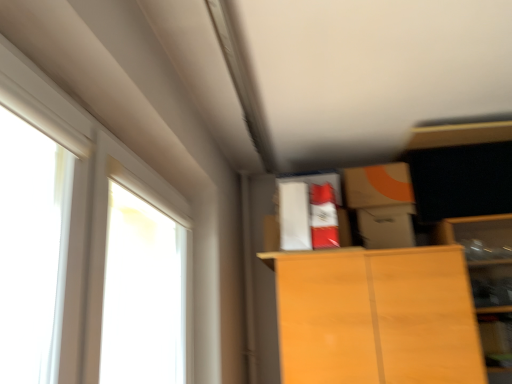
Based on the photo, measure the distance between point (10,67) and camera.

A distance of 79.00 centimeters exists between point (10,67) and camera.

Locate an element on the screen. This screenshot has width=512, height=384. white glossy window at upper left, the 1th window from the back is located at coordinates (87, 203).

What do you see at coordinates (87, 203) in the screenshot? I see `white glossy window at upper left, the second window viewed from the front` at bounding box center [87, 203].

Measure the distance between point (8,329) and camera.

Point (8,329) and camera are 6.59 feet apart.

Identify the location of white glossy window at left, the first window viewed from the front. (32, 249).

What do you see at coordinates (32, 249) in the screenshot? This screenshot has height=384, width=512. I see `white glossy window at left, the first window viewed from the front` at bounding box center [32, 249].

Identify the location of white glossy window at upper left, the 1th window from the back. (87, 203).

Looking at this image, based on their positions, is white glossy window at upper left, the 1th window from the back, located to the left or right of white glossy window at left, arranged as the second window when viewed from the back?

From the image, it's evident that white glossy window at upper left, the 1th window from the back, is to the right of white glossy window at left, arranged as the second window when viewed from the back.

Considering their positions, is white glossy window at upper left, the 1th window from the back, located in front of or behind white glossy window at left, arranged as the second window when viewed from the back?

white glossy window at upper left, the 1th window from the back, is behind white glossy window at left, arranged as the second window when viewed from the back.

Based on the photo, which is more distant, (92, 340) or (38, 246)?

Point (38, 246)

From the image's perspective, relative to white glossy window at left, the first window viewed from the front, is white glossy window at upper left, the second window viewed from the front, above or below?

white glossy window at upper left, the second window viewed from the front, is situated lower than white glossy window at left, the first window viewed from the front, in the image.

From a real-world perspective, which is physically below, white glossy window at upper left, the second window viewed from the front, or white glossy window at left, the first window viewed from the front?

From a 3D spatial view, white glossy window at upper left, the second window viewed from the front, is below.

Considering the sizes of objects white glossy window at upper left, the second window viewed from the front, and white glossy window at left, the first window viewed from the front, in the image provided, who is thinner, white glossy window at upper left, the second window viewed from the front, or white glossy window at left, the first window viewed from the front,?

white glossy window at left, the first window viewed from the front.

Can you confirm if white glossy window at upper left, the second window viewed from the front, is taller than white glossy window at left, the first window viewed from the front?

Indeed, white glossy window at upper left, the second window viewed from the front, has a greater height compared to white glossy window at left, the first window viewed from the front.

Considering the sizes of white glossy window at upper left, the 1th window from the back, and white glossy window at left, arranged as the second window when viewed from the back, in the image, is white glossy window at upper left, the 1th window from the back, bigger or smaller than white glossy window at left, arranged as the second window when viewed from the back,?

Considering their sizes, white glossy window at upper left, the 1th window from the back, takes up more space than white glossy window at left, arranged as the second window when viewed from the back.

Would you say white glossy window at upper left, the 1th window from the back, is outside white glossy window at left, the first window viewed from the front?

white glossy window at upper left, the 1th window from the back, is positioned outside white glossy window at left, the first window viewed from the front.

Can you see white glossy window at upper left, the second window viewed from the front, touching white glossy window at left, the first window viewed from the front?

There is a gap between white glossy window at upper left, the second window viewed from the front, and white glossy window at left, the first window viewed from the front.

Does white glossy window at upper left, the 1th window from the back, turn towards white glossy window at left, the first window viewed from the front?

No, white glossy window at upper left, the 1th window from the back, is not aimed at white glossy window at left, the first window viewed from the front.

How many degrees apart are the facing directions of white glossy window at upper left, the 1th window from the back, and white glossy window at left, the first window viewed from the front?

The angular difference between white glossy window at upper left, the 1th window from the back, and white glossy window at left, the first window viewed from the front, is 0.212 degrees.

The image size is (512, 384). I want to click on window above the white glossy window at upper left, the second window viewed from the front (from the image's perspective), so click(32, 249).

Is white glossy window at left, the first window viewed from the front, to the left of white glossy window at upper left, the second window viewed from the front, from the viewer's perspective?

Yes.

Which object is further away from the camera taking this photo, white glossy window at left, arranged as the second window when viewed from the back, or white glossy window at upper left, the second window viewed from the front?

white glossy window at upper left, the second window viewed from the front, is behind.

Is point (57, 362) behind point (85, 179)?

That is False.

From the image's perspective, is white glossy window at left, the first window viewed from the front, located above or below white glossy window at upper left, the 1th window from the back?

Based on their image positions, white glossy window at left, the first window viewed from the front, is located above white glossy window at upper left, the 1th window from the back.

From a real-world perspective, is white glossy window at left, the first window viewed from the front, positioned above or below white glossy window at upper left, the 1th window from the back?

In terms of real-world spatial position, white glossy window at left, the first window viewed from the front, is above white glossy window at upper left, the 1th window from the back.

Does white glossy window at left, the first window viewed from the front, have a greater width compared to white glossy window at upper left, the 1th window from the back?

No.

Considering the sizes of white glossy window at left, arranged as the second window when viewed from the back, and white glossy window at upper left, the 1th window from the back, in the image, is white glossy window at left, arranged as the second window when viewed from the back, taller or shorter than white glossy window at upper left, the 1th window from the back,?

Clearly, white glossy window at left, arranged as the second window when viewed from the back, is shorter compared to white glossy window at upper left, the 1th window from the back.

Can you confirm if white glossy window at left, the first window viewed from the front, is smaller than white glossy window at upper left, the 1th window from the back?

Yes.

Is white glossy window at left, the first window viewed from the front, surrounding white glossy window at upper left, the second window viewed from the front?

No, white glossy window at upper left, the second window viewed from the front, is not a part of white glossy window at left, the first window viewed from the front.

Are white glossy window at left, the first window viewed from the front, and white glossy window at upper left, the second window viewed from the front, making contact?

There is a gap between white glossy window at left, the first window viewed from the front, and white glossy window at upper left, the second window viewed from the front.

Is white glossy window at left, the first window viewed from the front, facing towards white glossy window at upper left, the second window viewed from the front?

No, white glossy window at left, the first window viewed from the front, is not facing towards white glossy window at upper left, the second window viewed from the front.

How different are the orientations of white glossy window at left, arranged as the second window when viewed from the back, and white glossy window at upper left, the second window viewed from the front, in degrees?

white glossy window at left, arranged as the second window when viewed from the back, and white glossy window at upper left, the second window viewed from the front, are facing 0.212 degrees away from each other.

Could you measure the distance between white glossy window at left, the first window viewed from the front, and white glossy window at upper left, the second window viewed from the front?

white glossy window at left, the first window viewed from the front, is 3.70 feet away from white glossy window at upper left, the second window viewed from the front.

Find the location of a particular element. Image resolution: width=512 pixels, height=384 pixels. window on the right of white glossy window at left, the first window viewed from the front is located at coordinates (87, 203).

Where is `window on the right of the white glossy window at left, the first window viewed from the front`? window on the right of the white glossy window at left, the first window viewed from the front is located at coordinates (87, 203).

The width and height of the screenshot is (512, 384). What are the coordinates of `window above the white glossy window at upper left, the 1th window from the back (from a real-world perspective)` in the screenshot? It's located at (32, 249).